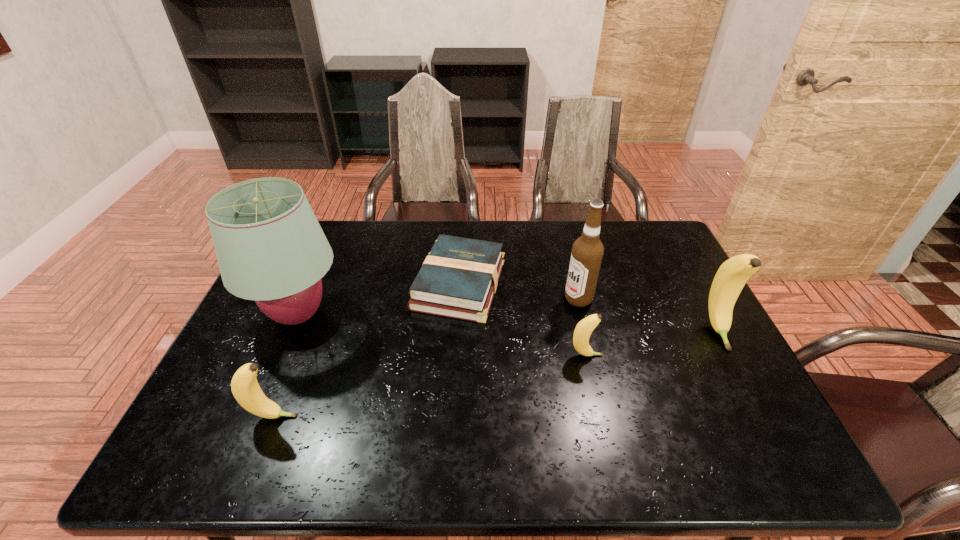
Locate an element on the screen. The image size is (960, 540). the fourth tallest object is located at coordinates (244, 385).

Find the location of a particular element. Image resolution: width=960 pixels, height=540 pixels. the leftmost banana is located at coordinates coord(244,385).

The width and height of the screenshot is (960, 540). In order to click on the second banana from left to right in this screenshot , I will do `click(583, 330)`.

Where is `the shortest banana`? The height and width of the screenshot is (540, 960). the shortest banana is located at coordinates (583, 330).

This screenshot has height=540, width=960. I want to click on the rightmost banana, so click(732, 275).

Find the location of a particular element. The height and width of the screenshot is (540, 960). the rightmost object is located at coordinates (732, 275).

The height and width of the screenshot is (540, 960). Identify the location of alcohol. (587, 252).

This screenshot has height=540, width=960. Identify the location of lampshade. (270, 248).

I want to click on the shortest object, so click(x=458, y=279).

Identify the location of the third object from left to right. (458, 279).